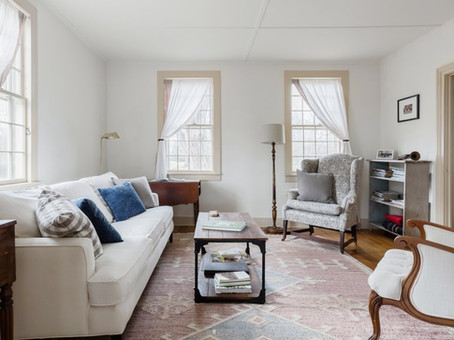
This screenshot has height=340, width=454. Find the location of `coffee table`. coffee table is located at coordinates (251, 232).